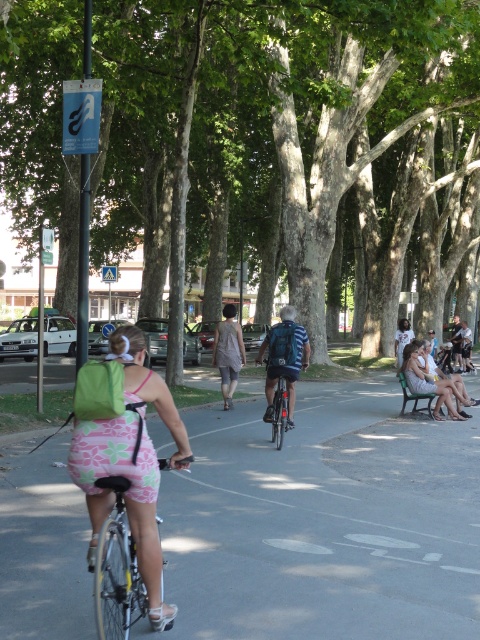
Is green fabric backpack at left bigger than light pink fabric dress at lower right?

Yes, green fabric backpack at left is bigger than light pink fabric dress at lower right.

Which is behind, point (118, 340) or point (440, 401)?

Point (440, 401)

The height and width of the screenshot is (640, 480). What are the coordinates of `green fabric backpack at left` in the screenshot? It's located at (126, 454).

In the scene shown: Can you confirm if green fabric backpack at left is shorter than green plastic bench at lower right?

In fact, green fabric backpack at left may be taller than green plastic bench at lower right.

Can you confirm if green fabric backpack at left is taller than green plastic bench at lower right?

Yes.

What do you see at coordinates (126, 454) in the screenshot?
I see `green fabric backpack at left` at bounding box center [126, 454].

Where is `green fabric backpack at left`? green fabric backpack at left is located at coordinates (126, 454).

Does green fabric backpack at left have a lesser width compared to pink fabric bicycle at center?

No.

This screenshot has width=480, height=640. I want to click on green fabric backpack at left, so click(x=126, y=454).

Image resolution: width=480 pixels, height=640 pixels. In order to click on green fabric backpack at left in this screenshot , I will do `click(126, 454)`.